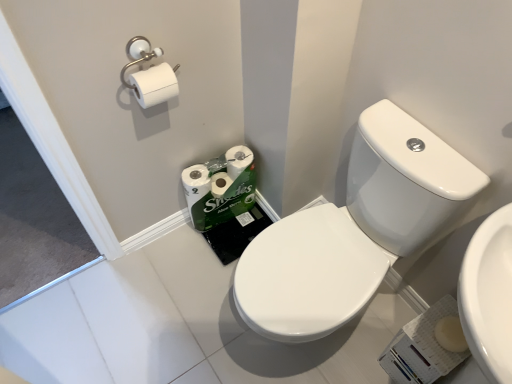
Question: Does green matte toilet paper at lower center, the second toilet paper in the front-to-back sequence, have a lesser height compared to white matte toilet paper at upper left, which is the 1th toilet paper from front to back?

Choices:
 (A) yes
 (B) no

Answer: (B)

Question: From a real-world perspective, is green matte toilet paper at lower center, which is counted as the first toilet paper, starting from the back, located beneath white matte toilet paper at upper left, the first toilet paper from the top?

Choices:
 (A) yes
 (B) no

Answer: (A)

Question: Is green matte toilet paper at lower center, the 2th toilet paper positioned from the top, surrounding white matte toilet paper at upper left, which is the 1th toilet paper from front to back?

Choices:
 (A) yes
 (B) no

Answer: (B)

Question: Is green matte toilet paper at lower center, the 2th toilet paper positioned from the top, oriented away from white matte toilet paper at upper left, the first toilet paper from the top?

Choices:
 (A) yes
 (B) no

Answer: (B)

Question: Does green matte toilet paper at lower center, the 2th toilet paper positioned from the top, appear on the left side of white matte toilet paper at upper left, positioned as the second toilet paper in back-to-front order?

Choices:
 (A) no
 (B) yes

Answer: (A)

Question: Would you say white matte toilet paper at upper left, positioned as the second toilet paper in back-to-front order, is inside or outside green matte toilet paper at lower center, which is counted as the first toilet paper, starting from the back?

Choices:
 (A) outside
 (B) inside

Answer: (A)

Question: Considering the positions of white matte toilet paper at upper left, positioned as the second toilet paper in back-to-front order, and green matte toilet paper at lower center, which is the 1th toilet paper from bottom to top, in the image, is white matte toilet paper at upper left, positioned as the second toilet paper in back-to-front order, wider or thinner than green matte toilet paper at lower center, which is the 1th toilet paper from bottom to top,?

Choices:
 (A) wide
 (B) thin

Answer: (B)

Question: Considering the positions of white matte toilet paper at upper left, positioned as the second toilet paper in back-to-front order, and green matte toilet paper at lower center, which is the 1th toilet paper from bottom to top, in the image, is white matte toilet paper at upper left, positioned as the second toilet paper in back-to-front order, bigger or smaller than green matte toilet paper at lower center, which is the 1th toilet paper from bottom to top,?

Choices:
 (A) big
 (B) small

Answer: (B)

Question: Is white matte toilet paper at upper left, the first toilet paper from the top, in front of or behind green matte toilet paper at lower center, the 2th toilet paper positioned from the top, in the image?

Choices:
 (A) behind
 (B) front

Answer: (B)

Question: Based on their sizes in the image, would you say white matte toilet paper at upper left, positioned as the second toilet paper in back-to-front order, is bigger or smaller than white glossy sink at center right?

Choices:
 (A) big
 (B) small

Answer: (B)

Question: From a real-world perspective, is white matte toilet paper at upper left, the first toilet paper from the top, above or below white glossy sink at center right?

Choices:
 (A) below
 (B) above

Answer: (B)

Question: Is white matte toilet paper at upper left, arranged as the 2th toilet paper when ordered from the bottom, in front of or behind white glossy sink at center right in the image?

Choices:
 (A) behind
 (B) front

Answer: (A)

Question: Is white matte toilet paper at upper left, which is the 1th toilet paper from front to back, inside or outside of white glossy sink at center right?

Choices:
 (A) outside
 (B) inside

Answer: (A)

Question: From the image's perspective, is white glossy sink at center right located above or below green matte toilet paper at lower center, the 2th toilet paper positioned from the top?

Choices:
 (A) above
 (B) below

Answer: (B)

Question: In terms of height, does white glossy sink at center right look taller or shorter compared to green matte toilet paper at lower center, which is the 1th toilet paper from bottom to top?

Choices:
 (A) tall
 (B) short

Answer: (A)